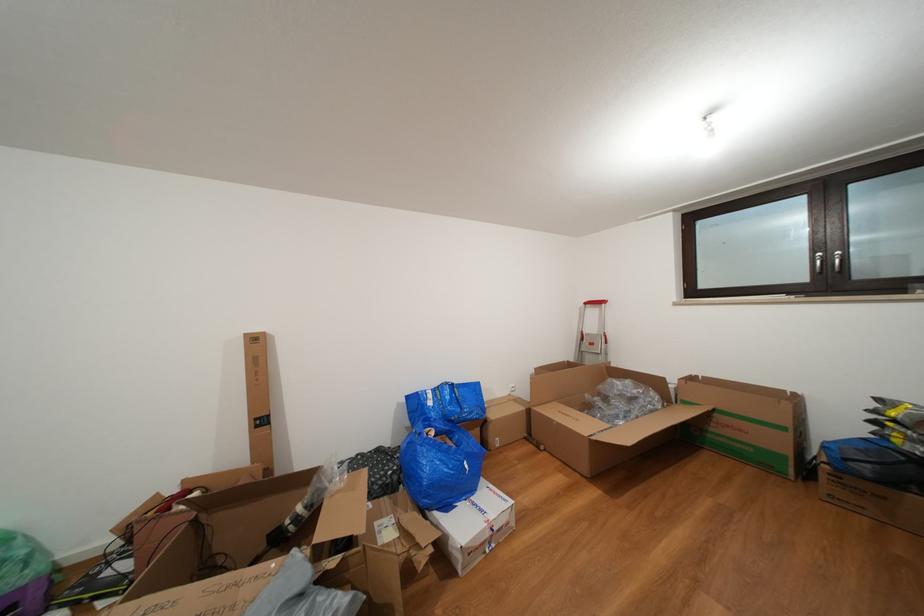
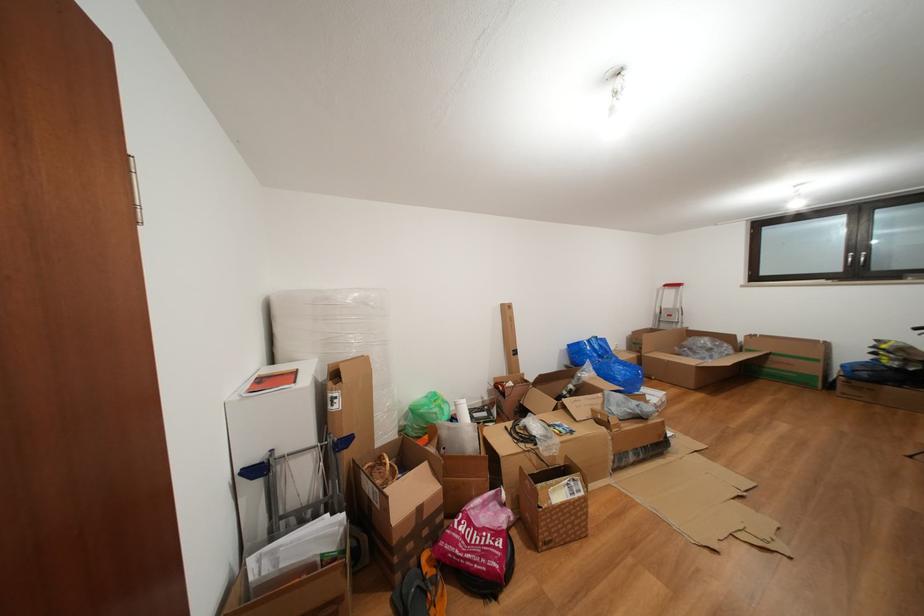
Find the pixel in the second image that matches pixel 442 395 in the first image.

(597, 346)